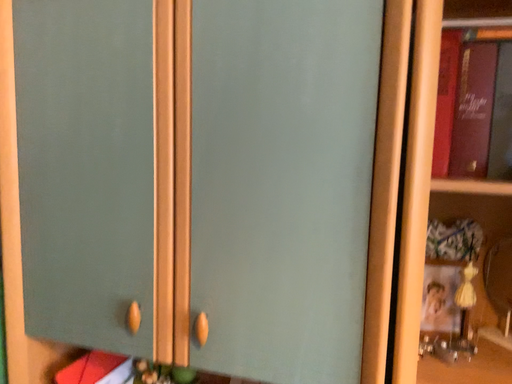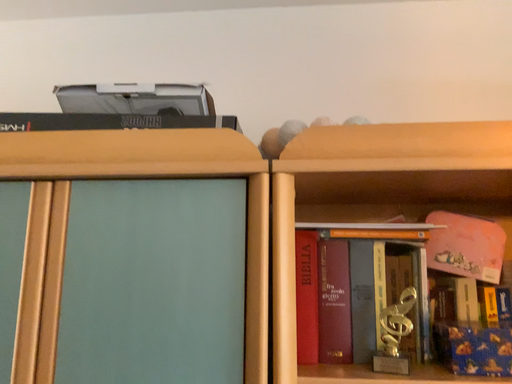
Question: How did the camera likely rotate when shooting the video?

Choices:
 (A) rotated right
 (B) rotated left

Answer: (A)